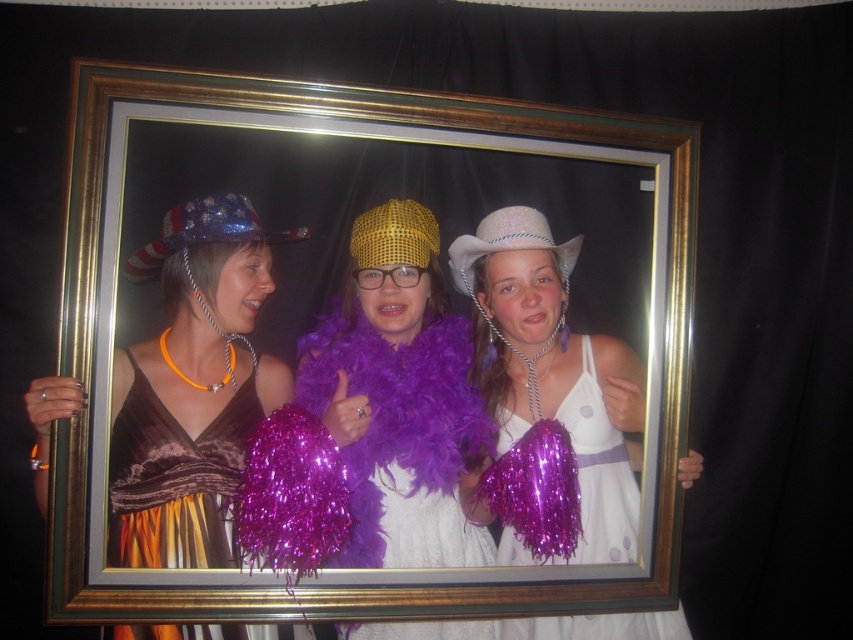
You are a photographer adjusting the focus on your camera. You need to focus on two points in the image, point 1 at coordinates point [107,541] and point 2 at coordinates point [581,477]. Which point should you focus on first to ensure the closest subject is sharp?

Point 1 at coordinates point [107,541] is closer to the camera than point 2 at coordinates point [581,477], so you should focus on point 1 first to ensure the closest subject is sharp.